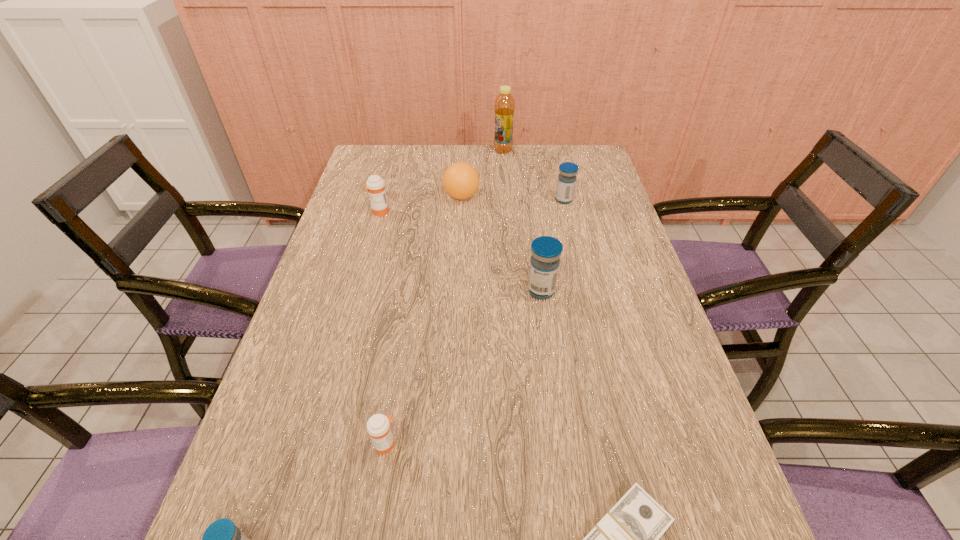
At what (x,y) coordinates should I click in order to perform the action: click on the tallest object. Please return your answer as a coordinate pair (x, y). Image resolution: width=960 pixels, height=540 pixels. Looking at the image, I should click on (504, 106).

Identify the location of the farthest object. The image size is (960, 540). (504, 106).

Where is `the second medicine from right to left`? the second medicine from right to left is located at coordinates (546, 251).

This screenshot has height=540, width=960. Find the location of `the second farthest blue medicine`. the second farthest blue medicine is located at coordinates click(546, 251).

The height and width of the screenshot is (540, 960). I want to click on the farthest medicine, so click(566, 182).

Where is `the second biggest blue medicine`? Image resolution: width=960 pixels, height=540 pixels. the second biggest blue medicine is located at coordinates (566, 182).

This screenshot has height=540, width=960. Find the location of `the second farthest medicine`. the second farthest medicine is located at coordinates (375, 184).

Locate an element on the screen. The image size is (960, 540). the left orange medicine is located at coordinates (375, 184).

Locate an element on the screen. The width and height of the screenshot is (960, 540). ping-pong ball is located at coordinates (461, 180).

At what (x,y) coordinates should I click in order to perform the action: click on the third object from left to right. Please return your answer as a coordinate pair (x, y). The width and height of the screenshot is (960, 540). Looking at the image, I should click on [x=378, y=426].